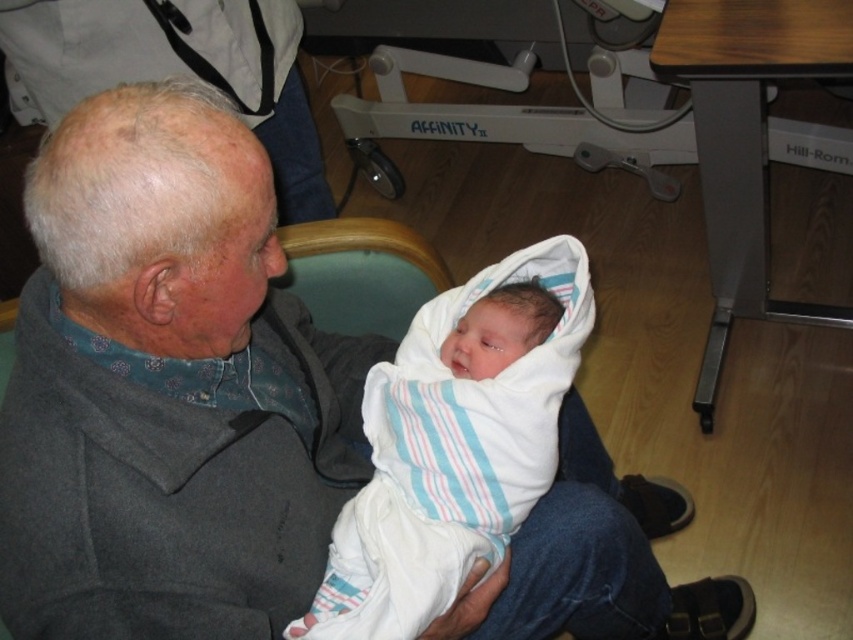
Looking at this image, you are a nurse in a hospital room and need to place a small medical kit between point A at point (268, 3) and point B at point (483, 337). Which point is closer to you so you can reach it first?

Point A at point (268, 3) is closer to you than point B at point (483, 337), so you can reach it first.

You are a nurse in a hospital room and need to determine which item is larger between the gray woolen sweater at upper left and the white striped swaddle at center. Which one is bigger?

The gray woolen sweater at upper left is bigger than the white striped swaddle at center according to the description.